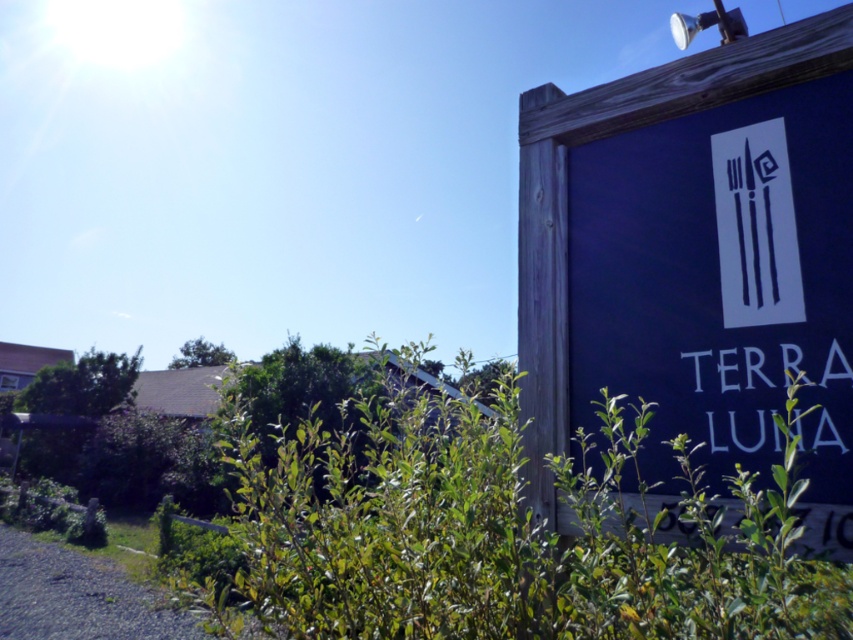
You are a hiker trying to navigate using the dark blue wooden sign at upper right and the green leafy bush at lower center. Which object is located to the right of the other?

The dark blue wooden sign at upper right is positioned on the right side of green leafy bush at lower center.

You are a landscape designer assessing the visibility of the dark blue wooden sign at upper right and the green leafy bush at lower center. Based on their widths, which object might be more challenging to see from a distance?

The dark blue wooden sign at upper right has a smaller width than the green leafy bush at lower center, making it potentially harder to see from a distance due to its narrower size.

You are standing in the outdoor scene and want to take a photo of both the dark blue wooden sign at upper right and the green leafy bush at lower center. Which object should you focus on first to ensure both are in focus?

You should focus on the dark blue wooden sign at upper right first because it is closer to you than the green leafy bush at lower center, so adjusting focus from near to far will help both be in focus.